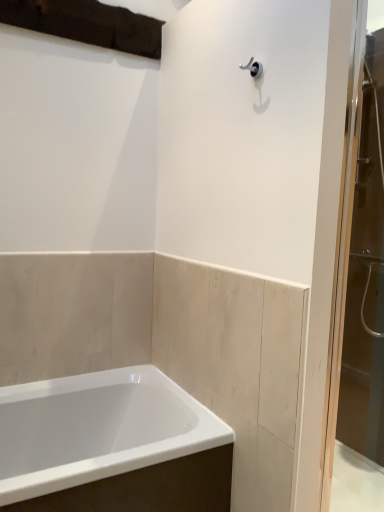
What is the approximate height of white glossy bathtub at lower left?

It is 22.98 inches.

Describe the element at coordinates (112, 445) in the screenshot. I see `white glossy bathtub at lower left` at that location.

I want to click on white glossy bathtub at lower left, so click(x=112, y=445).

Image resolution: width=384 pixels, height=512 pixels. Describe the element at coordinates (344, 241) in the screenshot. I see `transparent glass screen door at right` at that location.

Locate an element on the screen. The width and height of the screenshot is (384, 512). transparent glass screen door at right is located at coordinates [x=344, y=241].

Locate an element on the screen. The height and width of the screenshot is (512, 384). white glossy bathtub at lower left is located at coordinates (112, 445).

Visually, is white glossy bathtub at lower left positioned to the left or to the right of transparent glass screen door at right?

white glossy bathtub at lower left is to the left of transparent glass screen door at right.

Is the position of white glossy bathtub at lower left less distant than that of transparent glass screen door at right?

Yes, the depth of white glossy bathtub at lower left is less than that of transparent glass screen door at right.

Is point (126, 407) farther from viewer compared to point (354, 188)?

No, (126, 407) is in front of (354, 188).

From the image's perspective, which is above, white glossy bathtub at lower left or transparent glass screen door at right?

transparent glass screen door at right, from the image's perspective.

From a real-world perspective, between white glossy bathtub at lower left and transparent glass screen door at right, who is vertically higher?

In real-world perspective, transparent glass screen door at right is above.

Considering the relative sizes of white glossy bathtub at lower left and transparent glass screen door at right in the image provided, is white glossy bathtub at lower left wider than transparent glass screen door at right?

Yes.

In terms of height, does white glossy bathtub at lower left look taller or shorter compared to transparent glass screen door at right?

Considering their sizes, white glossy bathtub at lower left has less height than transparent glass screen door at right.

Looking at the image, does white glossy bathtub at lower left seem bigger or smaller compared to transparent glass screen door at right?

Considering their sizes, white glossy bathtub at lower left takes up more space than transparent glass screen door at right.

Consider the image. Do you think white glossy bathtub at lower left is within transparent glass screen door at right, or outside of it?

white glossy bathtub at lower left is located beyond the bounds of transparent glass screen door at right.

Based on the photo, is white glossy bathtub at lower left not close to transparent glass screen door at right?

No, there isn't a large distance between white glossy bathtub at lower left and transparent glass screen door at right.

From the picture: Does white glossy bathtub at lower left turn towards transparent glass screen door at right?

No, white glossy bathtub at lower left does not turn towards transparent glass screen door at right.

How many degrees apart are the facing directions of white glossy bathtub at lower left and transparent glass screen door at right?

white glossy bathtub at lower left and transparent glass screen door at right are facing 0.00299 degrees away from each other.

In order to click on bathtub directly beneath the transparent glass screen door at right (from a real-world perspective) in this screenshot , I will do pyautogui.click(x=112, y=445).

Looking at this image, between transparent glass screen door at right and white glossy bathtub at lower left, which one appears on the left side from the viewer's perspective?

From the viewer's perspective, white glossy bathtub at lower left appears more on the left side.

Is transparent glass screen door at right further to camera compared to white glossy bathtub at lower left?

Yes, it is.

Does point (349, 252) come farther from viewer compared to point (88, 484)?

Yes, point (349, 252) is behind point (88, 484).

From the image's perspective, between transparent glass screen door at right and white glossy bathtub at lower left, which one is located above?

transparent glass screen door at right, from the image's perspective.

From a real-world perspective, which is physically below, transparent glass screen door at right or white glossy bathtub at lower left?

white glossy bathtub at lower left, from a real-world perspective.

Which of these two, transparent glass screen door at right or white glossy bathtub at lower left, is wider?

With larger width is white glossy bathtub at lower left.

Between transparent glass screen door at right and white glossy bathtub at lower left, which one has more height?

Standing taller between the two is transparent glass screen door at right.

Considering the sizes of transparent glass screen door at right and white glossy bathtub at lower left in the image, is transparent glass screen door at right bigger or smaller than white glossy bathtub at lower left?

In the image, transparent glass screen door at right appears to be smaller than white glossy bathtub at lower left.

Is transparent glass screen door at right not within white glossy bathtub at lower left?

transparent glass screen door at right lies outside white glossy bathtub at lower left's area.

Is transparent glass screen door at right next to white glossy bathtub at lower left and touching it?

No, transparent glass screen door at right is not with white glossy bathtub at lower left.

Could you tell me if transparent glass screen door at right is facing white glossy bathtub at lower left?

No, transparent glass screen door at right is not facing towards white glossy bathtub at lower left.

How many degrees apart are the facing directions of transparent glass screen door at right and white glossy bathtub at lower left?

They differ by 0.00299 degrees in their facing directions.

In order to click on bathtub lying below the transparent glass screen door at right (from the image's perspective) in this screenshot , I will do `click(112, 445)`.

Locate an element on the screen. bathtub below the transparent glass screen door at right (from a real-world perspective) is located at coordinates (112, 445).

Find the location of a particular element. screen door on the right side of white glossy bathtub at lower left is located at coordinates (344, 241).